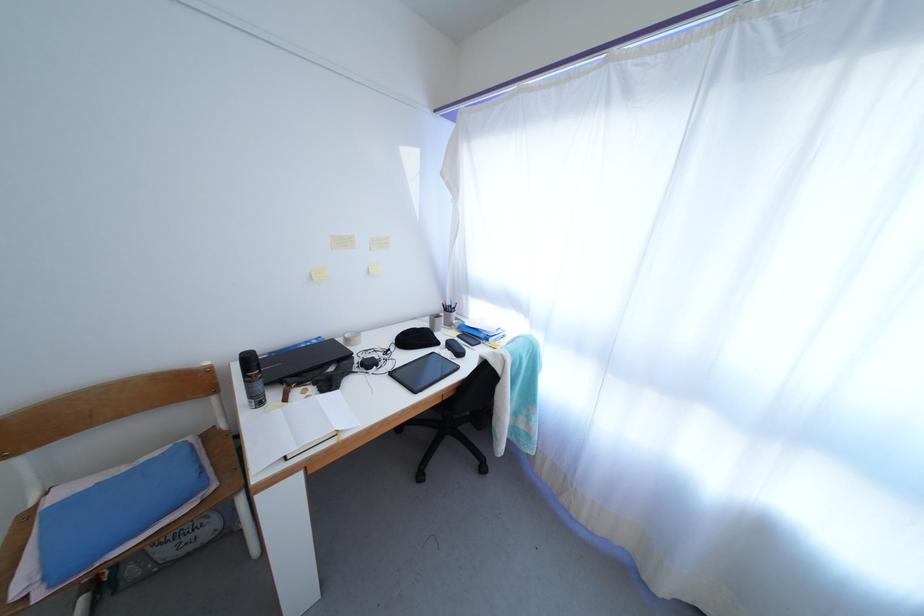
Which object does [455,347] point to?

It corresponds to the black computer mouse in the image.